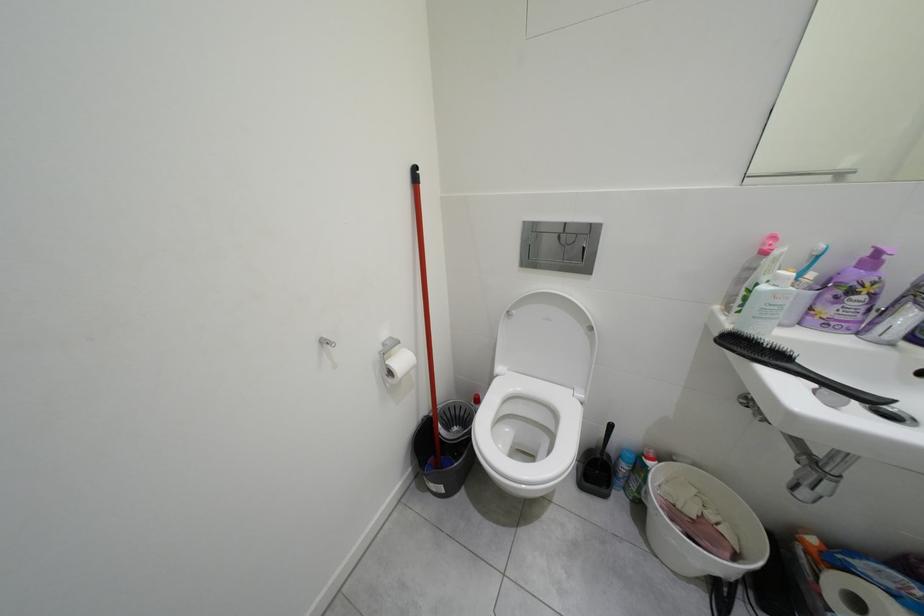
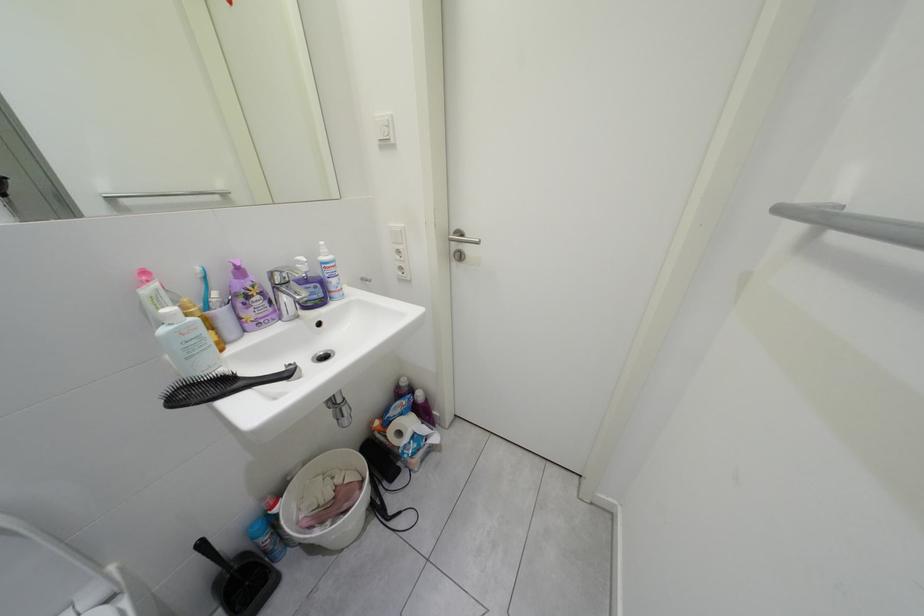
The images are taken continuously from a first-person perspective. In which direction is your viewpoint rotating?

The camera's rotation is toward right-down.